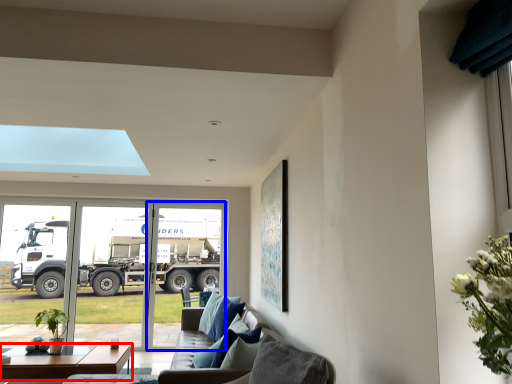
Question: Among these objects, which one is nearest to the camera, table (highlighted by a red box) or screen door (highlighted by a blue box)?

Choices:
 (A) table
 (B) screen door

Answer: (A)